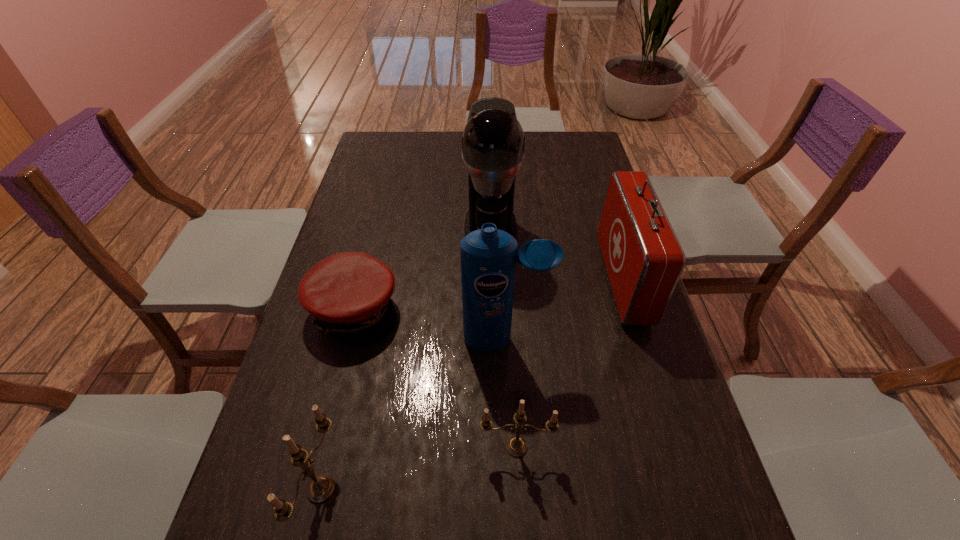
Locate an element on the screen. This screenshot has height=540, width=960. free location that satisfies the following two spatial constraints: 1. on the side of the fourth shortest object with the first aid cross symbol; 2. on the front side of the right candle is located at coordinates (675, 447).